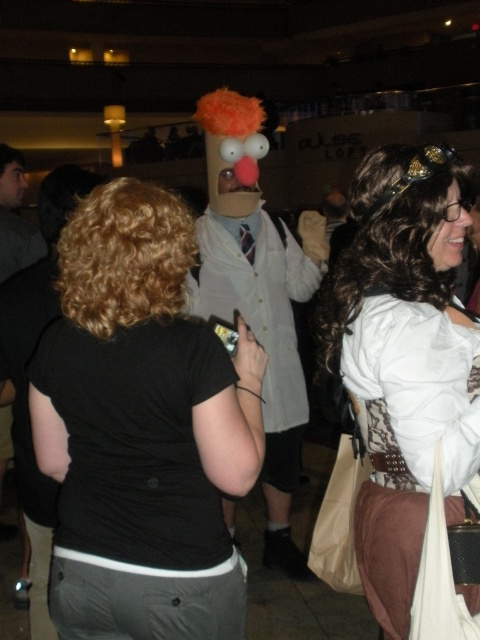
You are a photographer trying to capture a clear shot of the black matte shirt at center and the cardboard mask at center. Which object should you focus on first if you want to ensure both are in focus without adjusting the camera settings?

The black matte shirt at center is thinner than the cardboard mask at center, so you should focus on the cardboard mask at center first since it is larger and requires more depth of field to capture clearly.

You are at the entrance of the venue and want to locate the person wearing the black matte shirt at center. According to the coordinate system where the bottom left corner is the origin, what are the approximate coordinates where you should look?

The black matte shirt at center is located at coordinates approximately 0.672 on the x axis and 0.296 on the y axis.